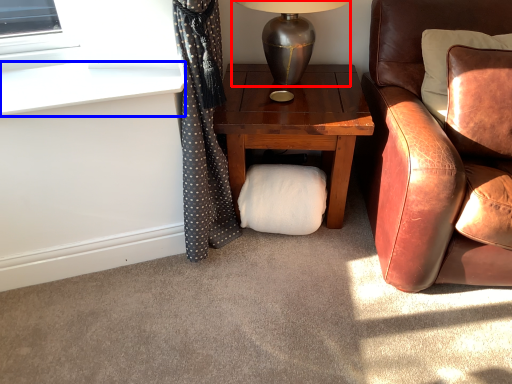
Question: Which point is further to the camera, table lamp (highlighted by a red box) or window sill (highlighted by a blue box)?

Choices:
 (A) table lamp
 (B) window sill

Answer: (A)